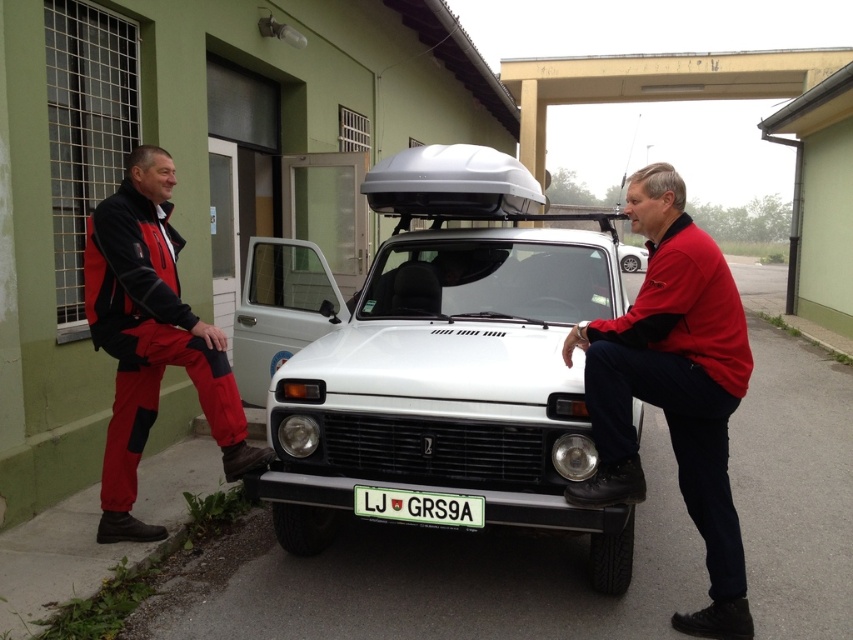
Who is more forward, (714, 320) or (209, 365)?

Positioned in front is point (714, 320).

Find the location of a particular element. Image resolution: width=853 pixels, height=640 pixels. red matte jacket at center is located at coordinates (672, 387).

Between red matte jacket at center and white plastic license plate at center, which one appears on the left side from the viewer's perspective?

white plastic license plate at center

Between point (722, 595) and point (410, 513), which one is positioned in front?

Point (722, 595)

Locate an element on the screen. The width and height of the screenshot is (853, 640). red matte jacket at center is located at coordinates (672, 387).

From the picture: Can you confirm if white matte truck at center is wider than white matte car at center?

In fact, white matte truck at center might be narrower than white matte car at center.

The height and width of the screenshot is (640, 853). Identify the location of white matte truck at center. (451, 364).

The width and height of the screenshot is (853, 640). I want to click on white matte truck at center, so click(x=451, y=364).